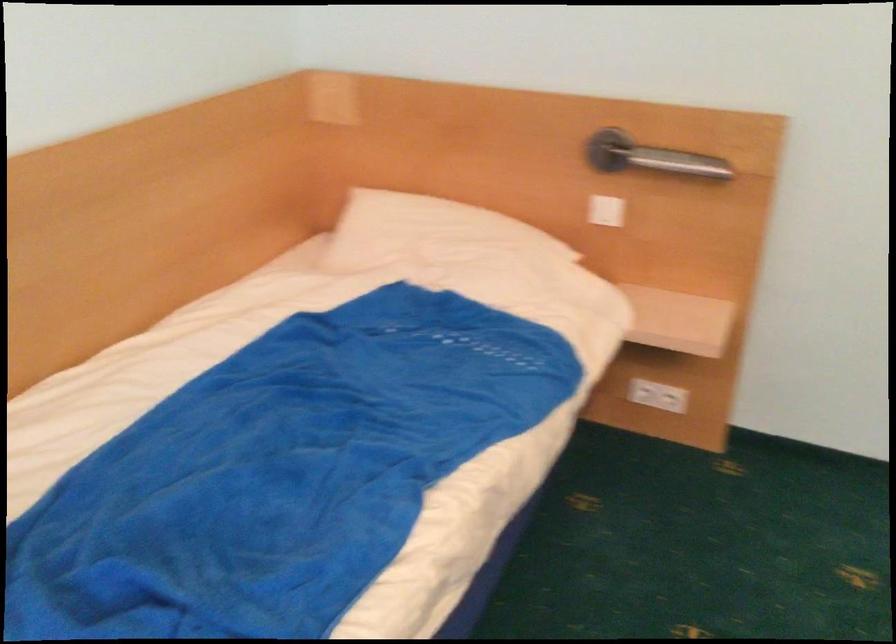
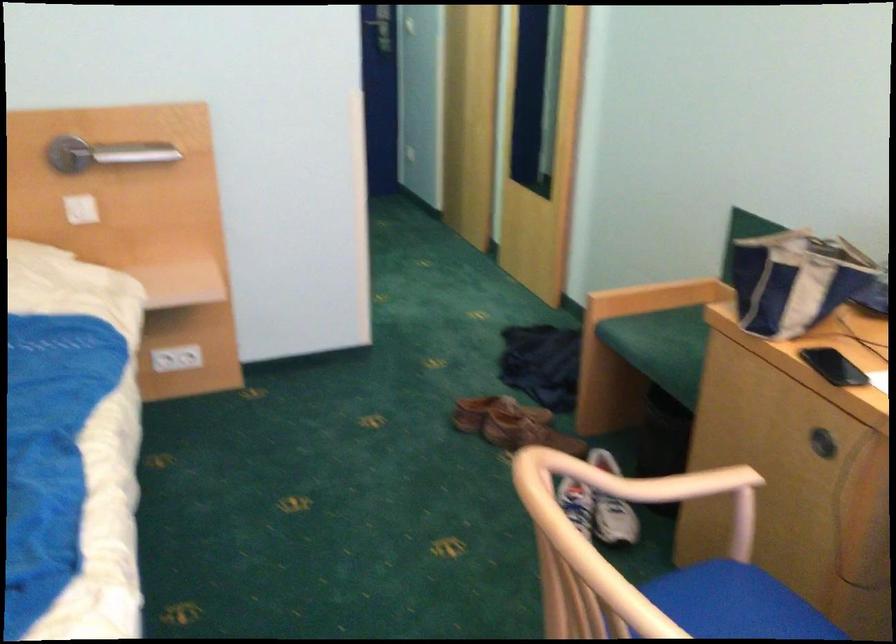
Find the pixel in the second image that matches point (655, 152) in the first image.

(105, 154)